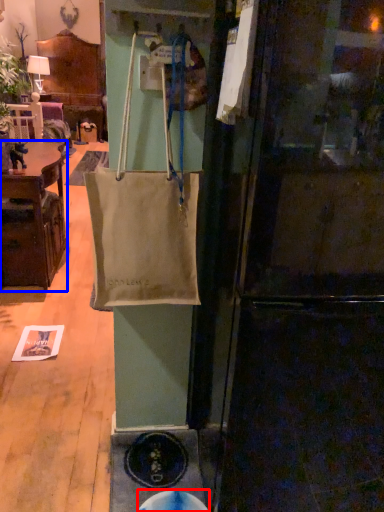
Question: Which object is closer to the camera taking this photo, manhole (highlighted by a red box) or cabinetry (highlighted by a blue box)?

Choices:
 (A) manhole
 (B) cabinetry

Answer: (A)